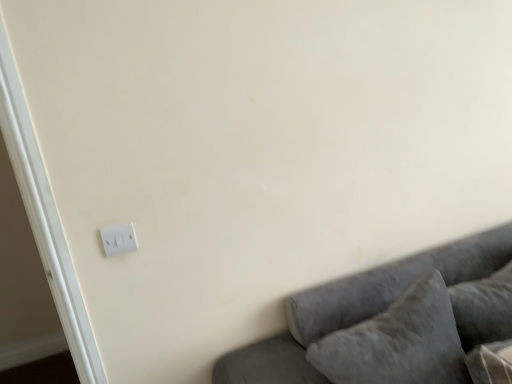
The width and height of the screenshot is (512, 384). Describe the element at coordinates (392, 283) in the screenshot. I see `velvet gray couch at lower right` at that location.

The width and height of the screenshot is (512, 384). What do you see at coordinates (483, 308) in the screenshot?
I see `velvety gray pillow at lower right, positioned as the second pillow in left-to-right order` at bounding box center [483, 308].

What is the approximate width of velvety gray pillow at lower right, positioned as the second pillow in left-to-right order?

velvety gray pillow at lower right, positioned as the second pillow in left-to-right order, is 10.81 inches wide.

Image resolution: width=512 pixels, height=384 pixels. Describe the element at coordinates (118, 238) in the screenshot. I see `white plastic light switch at lower left` at that location.

You are a GUI agent. You are given a task and a screenshot of the screen. Output one action in this format:
    pyautogui.click(x=<x>, y=<y>)
    Task: Click on the velvet gray couch at lower right
    Image resolution: width=512 pixels, height=384 pixels.
    Given the screenshot: What is the action you would take?
    pyautogui.click(x=392, y=283)

What's the angular difference between white plastic light switch at lower left and velvet gray pillow at lower right, which is the first pillow from left to right,'s facing directions?

There is a 0.827-degree angle between the facing directions of white plastic light switch at lower left and velvet gray pillow at lower right, which is the first pillow from left to right.

Is white plastic light switch at lower left not close to velvet gray pillow at lower right, marked as the second pillow in a right-to-left arrangement?

No, white plastic light switch at lower left is not far away from velvet gray pillow at lower right, marked as the second pillow in a right-to-left arrangement.

Does white plastic light switch at lower left appear on the right side of velvet gray pillow at lower right, which is the first pillow from left to right?

Incorrect, white plastic light switch at lower left is not on the right side of velvet gray pillow at lower right, which is the first pillow from left to right.

Based on the photo, from the image's perspective, is white plastic light switch at lower left located above velvet gray pillow at lower right, marked as the second pillow in a right-to-left arrangement?

Yes, from the image's perspective, white plastic light switch at lower left is on top of velvet gray pillow at lower right, marked as the second pillow in a right-to-left arrangement.

In terms of height, does velvet gray couch at lower right look taller or shorter compared to velvety gray pillow at lower right, the 1th pillow in the right-to-left sequence?

In the image, velvet gray couch at lower right appears to be taller than velvety gray pillow at lower right, the 1th pillow in the right-to-left sequence.

Looking at this image, which of these two, velvet gray couch at lower right or velvety gray pillow at lower right, the 1th pillow in the right-to-left sequence, is wider?

velvet gray couch at lower right is wider.

Based on the photo, is velvet gray couch at lower right located outside velvety gray pillow at lower right, positioned as the second pillow in left-to-right order?

Yes.

Are velvet gray couch at lower right and velvety gray pillow at lower right, the 1th pillow in the right-to-left sequence, located far from each other?

No, velvet gray couch at lower right is in close proximity to velvety gray pillow at lower right, the 1th pillow in the right-to-left sequence.

Which of these two, velvety gray pillow at lower right, positioned as the second pillow in left-to-right order, or white plastic light switch at lower left, is smaller?

white plastic light switch at lower left.

From a real-world perspective, is velvety gray pillow at lower right, the 1th pillow in the right-to-left sequence, located beneath white plastic light switch at lower left?

Correct, in the physical world, velvety gray pillow at lower right, the 1th pillow in the right-to-left sequence, is lower than white plastic light switch at lower left.

Locate an element on the screen. The image size is (512, 384). pillow that is the 1st one when counting downward from the white plastic light switch at lower left (from the image's perspective) is located at coordinates (483, 308).

Does velvet gray couch at lower right have a greater width compared to velvet gray pillow at lower right, marked as the second pillow in a right-to-left arrangement?

Yes, velvet gray couch at lower right is wider than velvet gray pillow at lower right, marked as the second pillow in a right-to-left arrangement.

Considering the positions of objects velvet gray couch at lower right and velvet gray pillow at lower right, which is the first pillow from left to right, in the image provided, who is more to the right, velvet gray couch at lower right or velvet gray pillow at lower right, which is the first pillow from left to right,?

velvet gray couch at lower right is more to the right.

Is velvet gray couch at lower right bigger or smaller than velvet gray pillow at lower right, marked as the second pillow in a right-to-left arrangement?

Clearly, velvet gray couch at lower right is larger in size than velvet gray pillow at lower right, marked as the second pillow in a right-to-left arrangement.

Is the depth of velvet gray couch at lower right less than that of velvet gray pillow at lower right, marked as the second pillow in a right-to-left arrangement?

Yes, velvet gray couch at lower right is closer to the camera.

Considering the sizes of objects velvet gray pillow at lower right, which is the first pillow from left to right, and white plastic light switch at lower left in the image provided, who is smaller, velvet gray pillow at lower right, which is the first pillow from left to right, or white plastic light switch at lower left?

white plastic light switch at lower left is smaller.

Where is `light switch above the velvet gray pillow at lower right, marked as the second pillow in a right-to-left arrangement (from the image's perspective)`? light switch above the velvet gray pillow at lower right, marked as the second pillow in a right-to-left arrangement (from the image's perspective) is located at coordinates (118, 238).

Is velvet gray pillow at lower right, which is the first pillow from left to right, looking in the opposite direction of white plastic light switch at lower left?

velvet gray pillow at lower right, which is the first pillow from left to right, is not turned away from white plastic light switch at lower left.

Identify the location of the 1st pillow in front when counting from the white plastic light switch at lower left. Image resolution: width=512 pixels, height=384 pixels. (483, 308).

What's the angular difference between white plastic light switch at lower left and velvety gray pillow at lower right, positioned as the second pillow in left-to-right order,'s facing directions?

The facing directions of white plastic light switch at lower left and velvety gray pillow at lower right, positioned as the second pillow in left-to-right order, are 0.827 degrees apart.

From a real-world perspective, which is physically below, white plastic light switch at lower left or velvety gray pillow at lower right, positioned as the second pillow in left-to-right order?

From a 3D spatial view, velvety gray pillow at lower right, positioned as the second pillow in left-to-right order, is below.

Considering the sizes of objects white plastic light switch at lower left and velvety gray pillow at lower right, the 1th pillow in the right-to-left sequence, in the image provided, who is thinner, white plastic light switch at lower left or velvety gray pillow at lower right, the 1th pillow in the right-to-left sequence,?

white plastic light switch at lower left is thinner.

Are velvet gray pillow at lower right, which is the first pillow from left to right, and velvet gray couch at lower right far apart?

They are positioned close to each other.

Which is correct: velvet gray pillow at lower right, which is the first pillow from left to right, is inside velvet gray couch at lower right, or outside of it?

velvet gray pillow at lower right, which is the first pillow from left to right, is contained in velvet gray couch at lower right.

How different are the orientations of velvet gray pillow at lower right, which is the first pillow from left to right, and velvet gray couch at lower right in degrees?

velvet gray pillow at lower right, which is the first pillow from left to right, and velvet gray couch at lower right are facing 0.962 degrees away from each other.

Which is in front, velvet gray pillow at lower right, marked as the second pillow in a right-to-left arrangement, or velvet gray couch at lower right?

velvet gray couch at lower right is closer to the camera.

Locate an element on the screen. The width and height of the screenshot is (512, 384). pillow that is the 2nd one below the white plastic light switch at lower left (from a real-world perspective) is located at coordinates pyautogui.click(x=398, y=342).

At what (x,y) coordinates should I click in order to perform the action: click on pillow on the right of velvet gray couch at lower right. Please return your answer as a coordinate pair (x, y). This screenshot has width=512, height=384. Looking at the image, I should click on (483, 308).

Based on their spatial positions, is velvet gray pillow at lower right, which is the first pillow from left to right, or velvet gray couch at lower right further from white plastic light switch at lower left?

velvet gray pillow at lower right, which is the first pillow from left to right, is positioned further to the anchor white plastic light switch at lower left.

Considering their positions, is velvet gray pillow at lower right, which is the first pillow from left to right, positioned closer to velvety gray pillow at lower right, the 1th pillow in the right-to-left sequence, than velvet gray couch at lower right?

The object closer to velvety gray pillow at lower right, the 1th pillow in the right-to-left sequence, is velvet gray pillow at lower right, which is the first pillow from left to right.

Which object lies further to the anchor point velvet gray pillow at lower right, marked as the second pillow in a right-to-left arrangement, velvety gray pillow at lower right, the 1th pillow in the right-to-left sequence, or velvet gray couch at lower right?

velvety gray pillow at lower right, the 1th pillow in the right-to-left sequence.

Considering their positions, is velvet gray couch at lower right positioned closer to velvety gray pillow at lower right, positioned as the second pillow in left-to-right order, than velvet gray pillow at lower right, which is the first pillow from left to right?

velvet gray pillow at lower right, which is the first pillow from left to right, is positioned closer to the anchor velvety gray pillow at lower right, positioned as the second pillow in left-to-right order.

Considering their positions, is velvet gray pillow at lower right, marked as the second pillow in a right-to-left arrangement, positioned closer to velvet gray couch at lower right than white plastic light switch at lower left?

velvet gray pillow at lower right, marked as the second pillow in a right-to-left arrangement, lies closer to velvet gray couch at lower right than the other object.

Looking at the image, which one is located further to velvety gray pillow at lower right, positioned as the second pillow in left-to-right order, white plastic light switch at lower left or velvet gray pillow at lower right, which is the first pillow from left to right?

The object further to velvety gray pillow at lower right, positioned as the second pillow in left-to-right order, is white plastic light switch at lower left.

Which object lies further to the anchor point velvet gray couch at lower right, velvety gray pillow at lower right, the 1th pillow in the right-to-left sequence, or white plastic light switch at lower left?

white plastic light switch at lower left.

Looking at the image, which one is located further to velvet gray couch at lower right, white plastic light switch at lower left or velvety gray pillow at lower right, the 1th pillow in the right-to-left sequence?

Among the two, white plastic light switch at lower left is located further to velvet gray couch at lower right.

Locate an element on the screen. pillow between white plastic light switch at lower left and velvety gray pillow at lower right, positioned as the second pillow in left-to-right order, from left to right is located at coordinates (398, 342).

Where is `studio couch located between velvet gray pillow at lower right, which is the first pillow from left to right, and velvety gray pillow at lower right, positioned as the second pillow in left-to-right order, in the left-right direction`? The height and width of the screenshot is (384, 512). studio couch located between velvet gray pillow at lower right, which is the first pillow from left to right, and velvety gray pillow at lower right, positioned as the second pillow in left-to-right order, in the left-right direction is located at coordinates (392, 283).

Image resolution: width=512 pixels, height=384 pixels. Find the location of `pillow between white plastic light switch at lower left and velvet gray couch at lower right from left to right`. pillow between white plastic light switch at lower left and velvet gray couch at lower right from left to right is located at coordinates (398, 342).

Where is `studio couch located between white plastic light switch at lower left and velvety gray pillow at lower right, positioned as the second pillow in left-to-right order, in the left-right direction`? studio couch located between white plastic light switch at lower left and velvety gray pillow at lower right, positioned as the second pillow in left-to-right order, in the left-right direction is located at coordinates (392, 283).